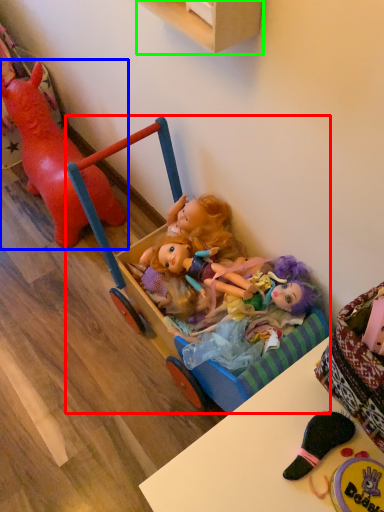
Question: Based on their relative distances, which object is farther from baby carriage (highlighted by a red box)? Choose from toy (highlighted by a blue box) and cabinetry (highlighted by a green box).

Choices:
 (A) toy
 (B) cabinetry

Answer: (B)